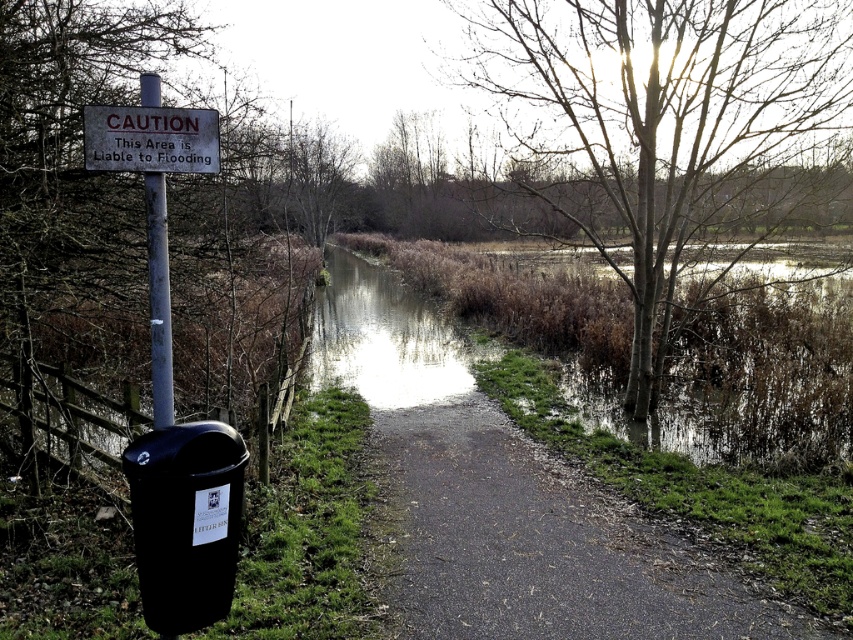
Does white plastic sign at upper left have a greater height compared to white plastic pole at upper left?

No.

Is white plastic sign at upper left thinner than white plastic pole at upper left?

No, white plastic sign at upper left is not thinner than white plastic pole at upper left.

What are the coordinates of `white plastic sign at upper left` in the screenshot? It's located at (149, 138).

Is black asphalt path at center to the right of white plastic pole at upper left from the viewer's perspective?

Indeed, black asphalt path at center is positioned on the right side of white plastic pole at upper left.

You are a GUI agent. You are given a task and a screenshot of the screen. Output one action in this format:
    pyautogui.click(x=<x>, y=<y>)
    Task: Click on the black asphalt path at center
    This screenshot has width=853, height=640.
    Given the screenshot: What is the action you would take?
    tap(537, 544)

This screenshot has height=640, width=853. What do you see at coordinates (660, 125) in the screenshot?
I see `bare wood tree at upper center` at bounding box center [660, 125].

Does point (697, 305) come farther from viewer compared to point (154, 424)?

That is True.

You are a GUI agent. You are given a task and a screenshot of the screen. Output one action in this format:
    pyautogui.click(x=<x>, y=<y>)
    Task: Click on the bare wood tree at upper center
    This screenshot has width=853, height=640.
    Given the screenshot: What is the action you would take?
    pyautogui.click(x=660, y=125)